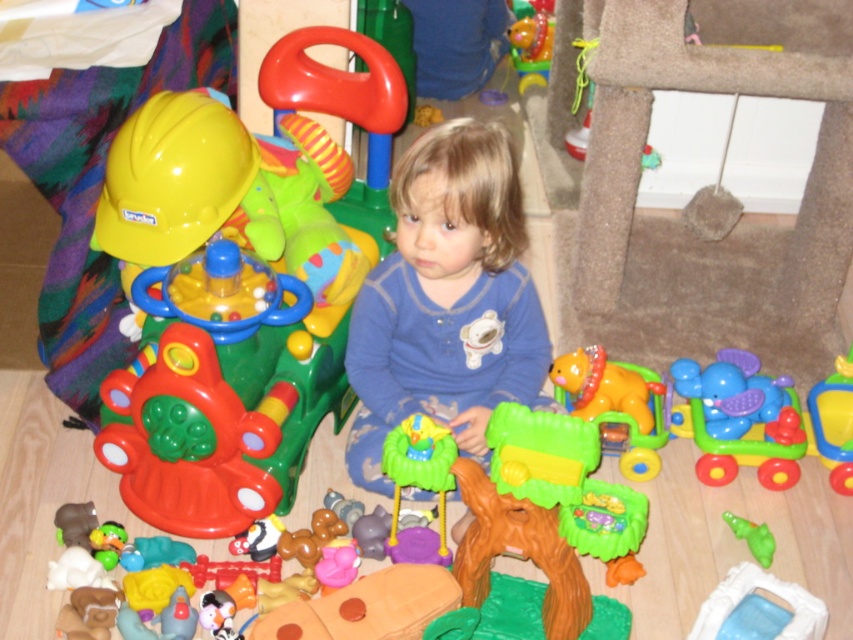
You are a toy robot in the playroom. You are currently at point (384, 452) and want to move to point (689, 371). Can you reach the target point without moving past it?

Point (689, 371) is behind point (384, 452), so yes, the robot can move backward to reach point (689, 371) without moving past it.

You are organizing a playroom and need to place the matte plastic construction helmet at left and the translucent plastic swing at center into storage bins. If the swing requires a bin that can accommodate its width, which object requires a wider bin?

Result: The matte plastic construction helmet at left requires a wider bin because its width is larger than the translucent plastic swing at center.